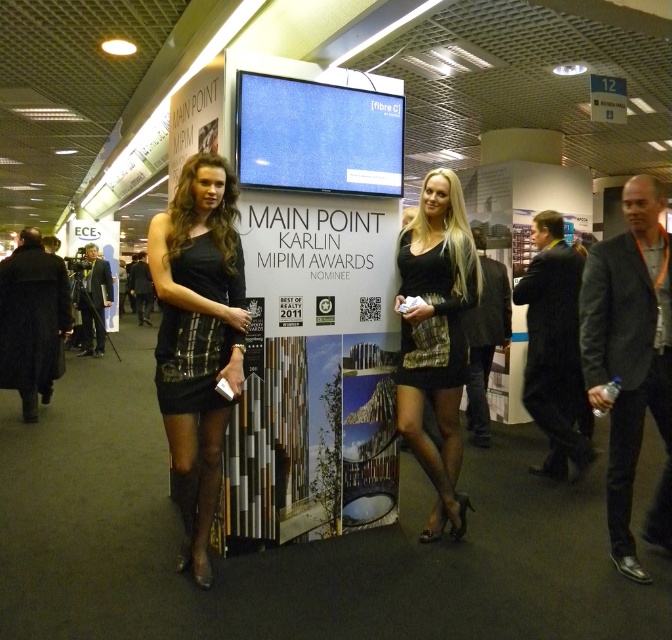
You are attending the Main Point Karlin MIPIM Awards and want to take a photo of the blue fabric screen at center while also including the black satin dress at center in the frame. Can you position yourself in a way that both objects are visible in the same photo?

Yes, since the black satin dress at center is to the left of the blue fabric screen at center, you can position yourself to the left of both objects so that the black satin dress at center is on the left side of the frame and the blue fabric screen at center is on the right side, ensuring both are visible in the photo.

You are a photographer at the event and need to capture a group photo of the two women wearing the shiny black dress at center and the black plaid dress at left. Considering their dress widths, which dress will require more space in the photo frame to avoid cropping?

The shiny black dress at center requires more space in the photo frame because its width is larger than the black plaid dress at left.

You are a photographer at the event and need to capture a photo that includes both the black satin dress at center and the blue fabric screen at center. Since you want to ensure both are visible, which object should be placed closer to the camera to avoid being cut off?

The black satin dress at center is taller than the blue fabric screen at center, so to ensure both are visible in the photo, the shorter blue fabric screen at center should be placed closer to the camera.